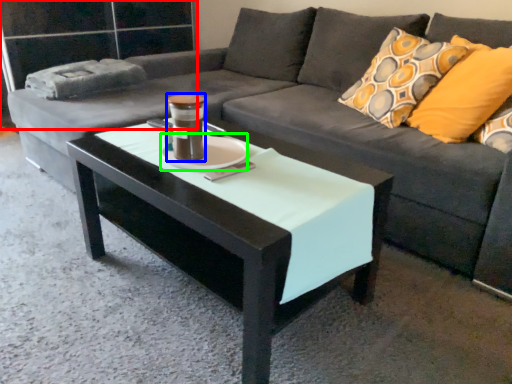
Question: Based on their relative distances, which object is nearer to glass door (highlighted by a red box)? Choose from beverage (highlighted by a blue box) and saucer (highlighted by a green box).

Choices:
 (A) beverage
 (B) saucer

Answer: (B)